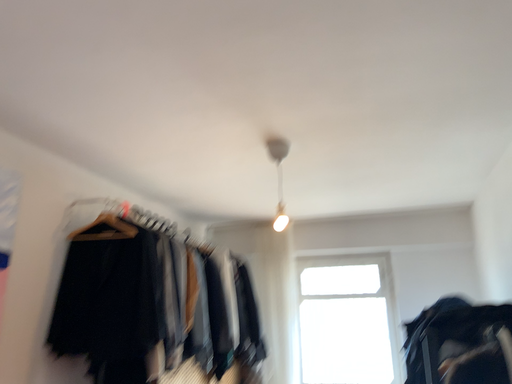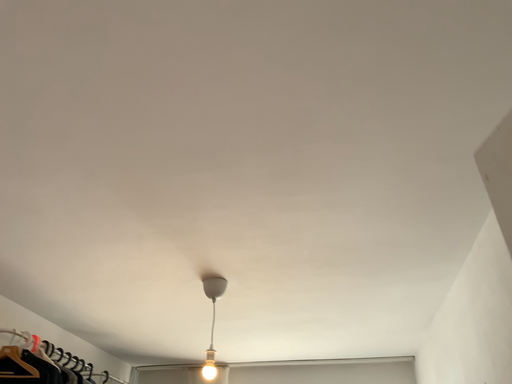
Question: Which way did the camera rotate in the video?

Choices:
 (A) rotated downward
 (B) rotated upward

Answer: (B)